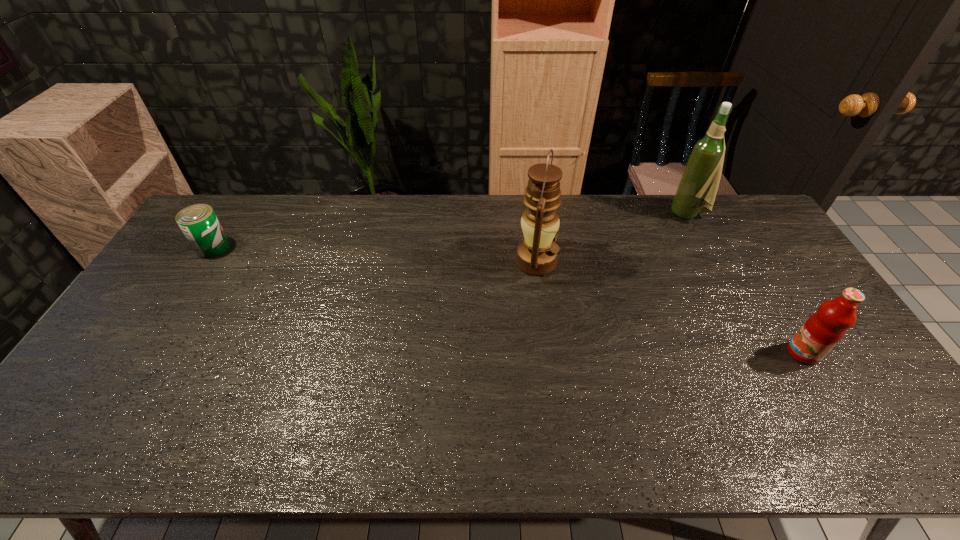
Where is `empty space that is in between the wine bottle and the rightmost object`? This screenshot has width=960, height=540. empty space that is in between the wine bottle and the rightmost object is located at coordinates (745, 284).

Locate an element on the screen. free space between the farthest object and the third tallest object is located at coordinates (745, 284).

You are a GUI agent. You are given a task and a screenshot of the screen. Output one action in this format:
    pyautogui.click(x=<x>, y=<y>)
    Task: Click on the vacant space in between the nearest object and the third object from right to left
    
    Given the screenshot: What is the action you would take?
    pyautogui.click(x=669, y=307)

The width and height of the screenshot is (960, 540). What are the coordinates of `free spot between the leftmost object and the farthest object` in the screenshot? It's located at (450, 231).

At what (x,y) coordinates should I click in order to perform the action: click on vacant area that lies between the oil lamp and the nearest object. Please return your answer as a coordinate pair (x, y). Looking at the image, I should click on (669, 307).

In order to click on object that is the nearest to the second object from right to left in this screenshot , I will do `click(536, 255)`.

Locate an element on the screen. the third closest object relative to the can is located at coordinates (824, 329).